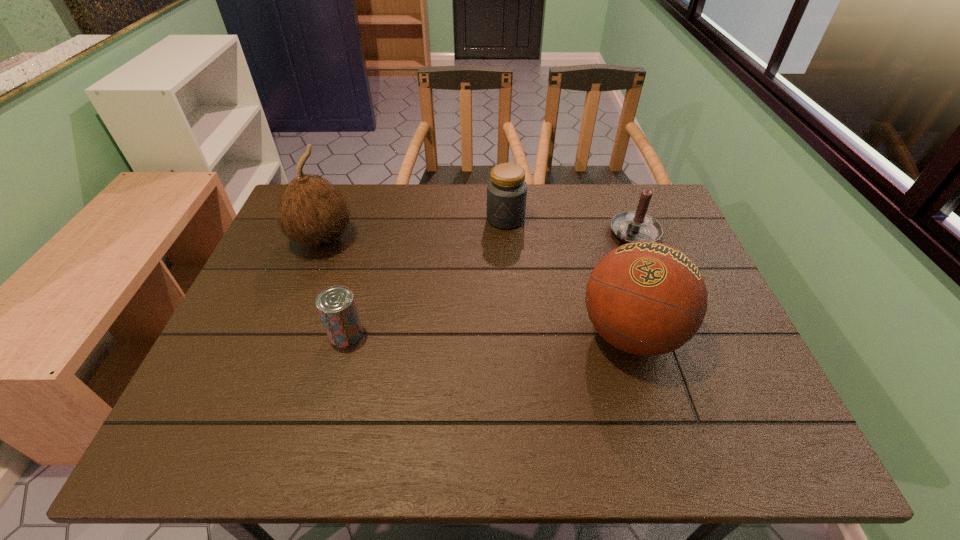
What are the coordinates of `free space on the desktop that is between the second object from left to right and the basketball and is positioned on the surface of the coconut` in the screenshot? It's located at (505, 334).

This screenshot has height=540, width=960. Identify the location of free spot on the desktop that is between the beer can and the basketball and is positioned on the surface of the jar near the warning symbol. (456, 334).

Find the location of a particular element. free spot on the desktop that is between the beer can and the basketball and is positioned on the side of the candle with the handle loop is located at coordinates (489, 334).